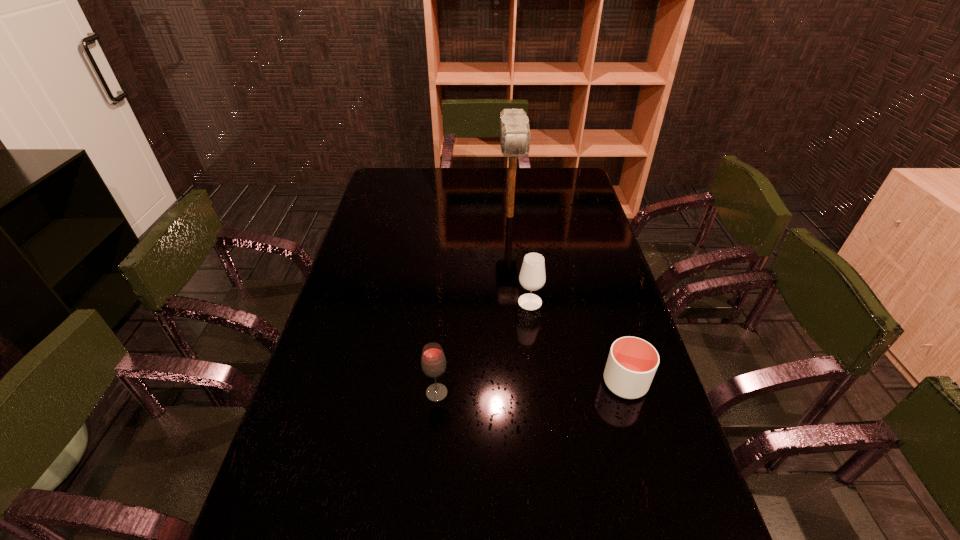
Find the location of a particular element. Image resolution: width=960 pixels, height=540 pixels. vacant space in between the cup and the right glass drink container is located at coordinates (578, 342).

The height and width of the screenshot is (540, 960). Identify the location of vacant space that is in between the farthest object and the cup. (567, 299).

Locate an element on the screen. The height and width of the screenshot is (540, 960). free point between the farthest object and the right glass drink container is located at coordinates (520, 259).

Where is `free space between the second farthest object and the nearer glass drink container`? free space between the second farthest object and the nearer glass drink container is located at coordinates (484, 347).

Find the location of a particular element. vacant space that's between the nearer glass drink container and the tallest object is located at coordinates (473, 305).

Locate an element on the screen. Image resolution: width=960 pixels, height=540 pixels. vacant space in between the right glass drink container and the left glass drink container is located at coordinates (484, 347).

Locate an element on the screen. The height and width of the screenshot is (540, 960). free space between the cup and the right glass drink container is located at coordinates (578, 342).

Select which object appears as the closest to the right glass drink container. Please provide its 2D coordinates. Your answer should be formatted as a tuple, i.e. [(x, y)], where the tuple contains the x and y coordinates of a point satisfying the conditions above.

[(632, 362)]

Choose which object is the second nearest neighbor to the farther glass drink container. Please provide its 2D coordinates. Your answer should be formatted as a tuple, i.e. [(x, y)], where the tuple contains the x and y coordinates of a point satisfying the conditions above.

[(433, 362)]

The image size is (960, 540). I want to click on vacant point that satisfies the following two spatial constraints: 1. on the striking face of the shortest object; 2. on the left side of the farthest object, so click(x=525, y=383).